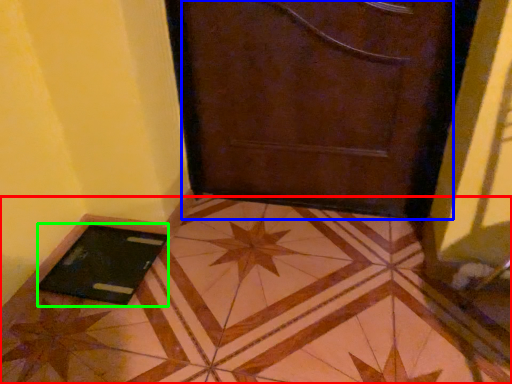
Question: Which is farther away from tile (highlighted by a red box)? door (highlighted by a blue box) or tablet computer (highlighted by a green box)?

Choices:
 (A) door
 (B) tablet computer

Answer: (A)